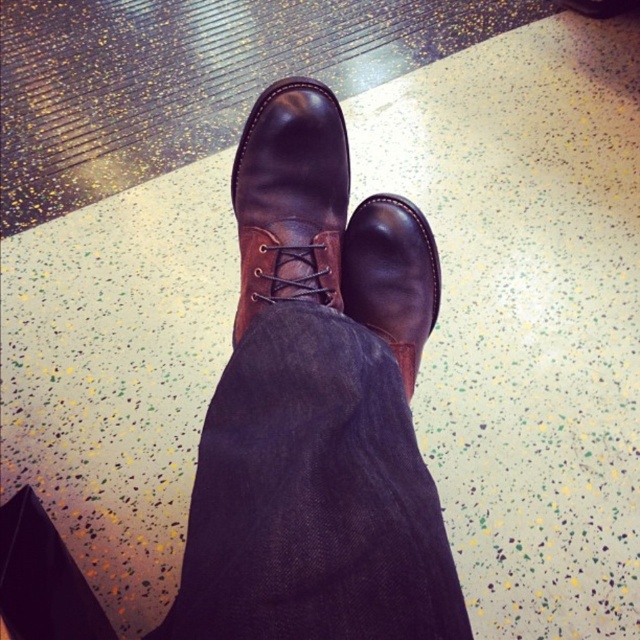
You are a photographer setting up a shoot in the scene described. You need to position a small reflective object between the dark blue denim jeans at center and the brown leather boot at center. Based on their positions, where should you place it?

The dark blue denim jeans at center is below the brown leather boot at center, so the reflective object should be placed between them, positioning it under the boot but above the jeans.